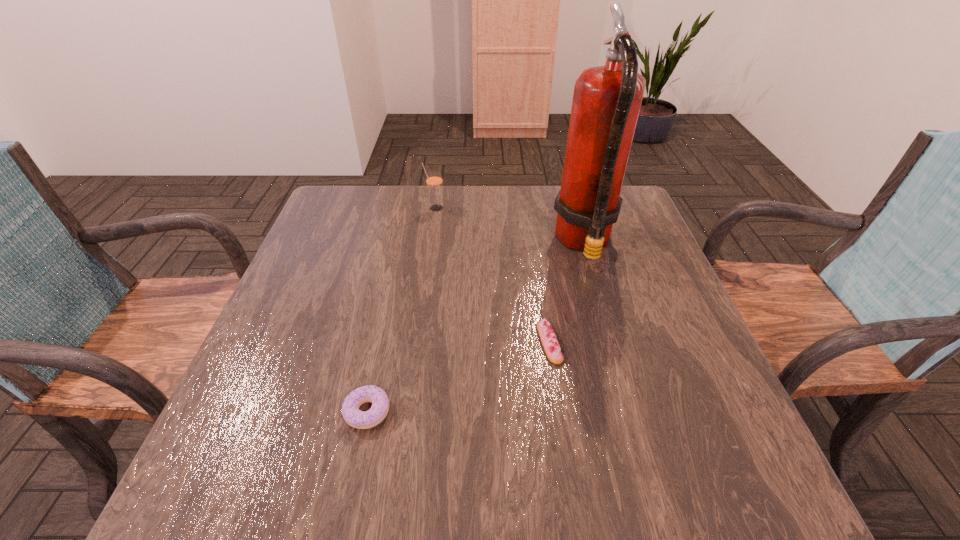
Identify the location of vacant space located at the nozzle of the fire extinguisher. (492, 242).

At what (x,y) coordinates should I click in order to perform the action: click on vacant space located on the front of the second tallest object. Please return your answer as a coordinate pair (x, y). This screenshot has width=960, height=540. Looking at the image, I should click on (430, 244).

Image resolution: width=960 pixels, height=540 pixels. Find the location of `free space located on the right of the leftmost object`. free space located on the right of the leftmost object is located at coordinates (445, 411).

In order to click on free point located 0.100m on the front of the third object from left to right in this screenshot , I will do `click(560, 411)`.

Identify the location of fire extinguisher that is at the far edge. Image resolution: width=960 pixels, height=540 pixels. (606, 103).

At what (x,y) coordinates should I click in order to perform the action: click on straw located at the far edge. Please return your answer as a coordinate pair (x, y). This screenshot has width=960, height=540. Looking at the image, I should click on (434, 181).

Where is `object that is at the right edge`? object that is at the right edge is located at coordinates (606, 103).

In order to click on object that is at the far right corner in this screenshot , I will do `click(606, 103)`.

The width and height of the screenshot is (960, 540). I want to click on vacant region at the far edge of the desktop, so click(x=486, y=210).

In the image, there is a desktop. Identify the location of vacant space at the near edge. The height and width of the screenshot is (540, 960). (449, 459).